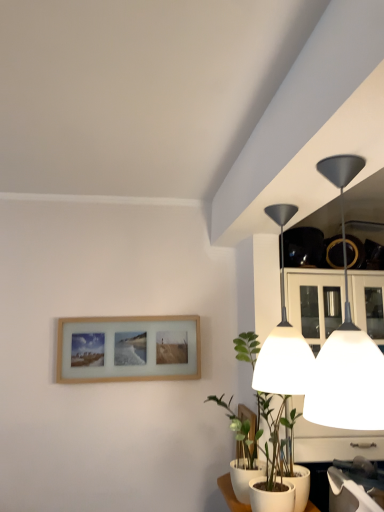
Question: From the image's perspective, is white matte lampshade at upper right, which is the second lamp from front to back, located above or below matte black lampshade at upper right, which is the 2th lamp in back-to-front order?

Choices:
 (A) above
 (B) below

Answer: (B)

Question: Choose the correct answer: Is white matte lampshade at upper right, the first lamp when ordered from back to front, inside matte black lampshade at upper right, which is the 1th lamp from front to back, or outside it?

Choices:
 (A) outside
 (B) inside

Answer: (A)

Question: Estimate the real-world distances between objects in this image. Which object is closer to the matte black lampshade at upper right, which is the 1th lamp from front to back?

Choices:
 (A) wooden picture frame at lower center, placed as the 1th picture frame when sorted from bottom to top
 (B) green matte plant at lower right
 (C) wooden picture frame at lower left, the first picture frame in the left-to-right sequence
 (D) white matte lampshade at upper right, the first lamp when ordered from back to front

Answer: (D)

Question: Considering the real-world distances, which object is closest to the green matte plant at lower right?

Choices:
 (A) white matte lampshade at upper right, which is the second lamp from front to back
 (B) wooden picture frame at lower left, the 2th picture frame when ordered from front to back
 (C) wooden picture frame at lower center, acting as the first picture frame starting from the front
 (D) matte black lampshade at upper right, which is the 1th lamp from front to back

Answer: (C)